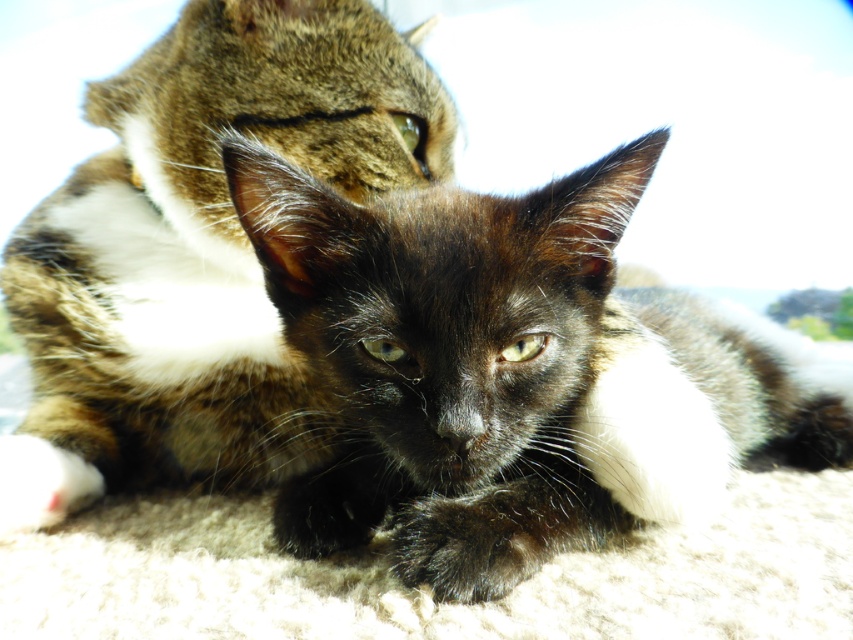
Question: Which point is closer to the camera?

Choices:
 (A) black glossy fur cat at center
 (B) black fur cat at center
 (C) black fuzzy paw at lower center

Answer: (C)

Question: Which object is the farthest from the black fur cat at center?

Choices:
 (A) black glossy fur cat at center
 (B) black fuzzy paw at lower center

Answer: (B)

Question: Which object appears farthest from the camera in this image?

Choices:
 (A) black glossy fur cat at center
 (B) black fuzzy paw at lower center

Answer: (A)

Question: Does black glossy fur cat at center have a greater width compared to black fur cat at center?

Choices:
 (A) no
 (B) yes

Answer: (B)

Question: Observing the image, what is the correct spatial positioning of black glossy fur cat at center in reference to black fur cat at center?

Choices:
 (A) below
 (B) above

Answer: (A)

Question: Does black glossy fur cat at center appear on the right side of black fur cat at center?

Choices:
 (A) yes
 (B) no

Answer: (A)